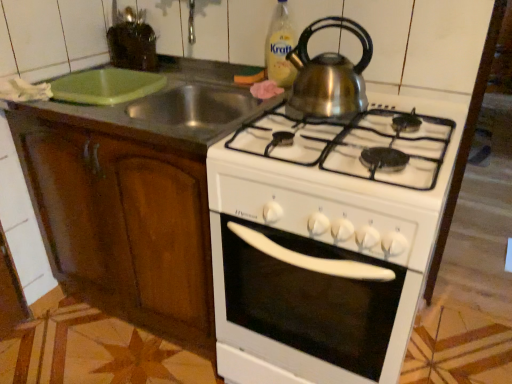
Question: Considering their positions, is wooden cabinet at left located in front of or behind translucent plastic bottle at upper center?

Choices:
 (A) front
 (B) behind

Answer: (A)

Question: Is wooden cabinet at left spatially inside translucent plastic bottle at upper center, or outside of it?

Choices:
 (A) inside
 (B) outside

Answer: (B)

Question: Which object is positioned closest to the shiny metallic kettle at upper center?

Choices:
 (A) green plastic cutting board at upper left
 (B) wooden cabinet at left
 (C) translucent plastic bottle at upper center
 (D) white glossy oven at center

Answer: (C)

Question: Considering the real-world distances, which object is closest to the wooden cabinet at left?

Choices:
 (A) shiny metallic kettle at upper center
 (B) translucent plastic bottle at upper center
 (C) green plastic cutting board at upper left
 (D) white glossy oven at center

Answer: (C)